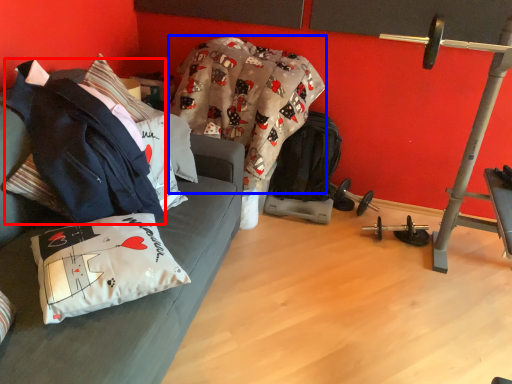
Question: Which object appears farthest to the camera in this image, jacket (highlighted by a red box) or blanket (highlighted by a blue box)?

Choices:
 (A) jacket
 (B) blanket

Answer: (B)